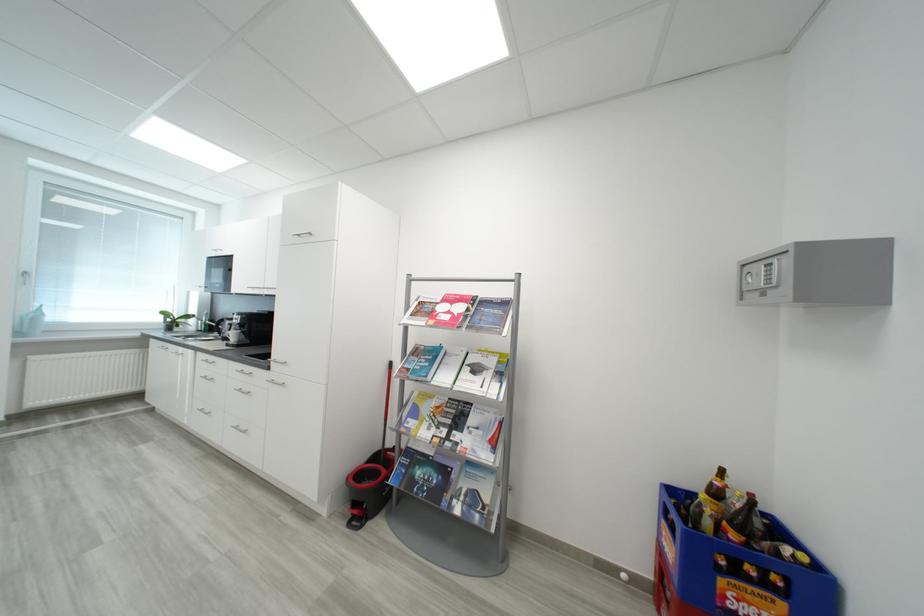
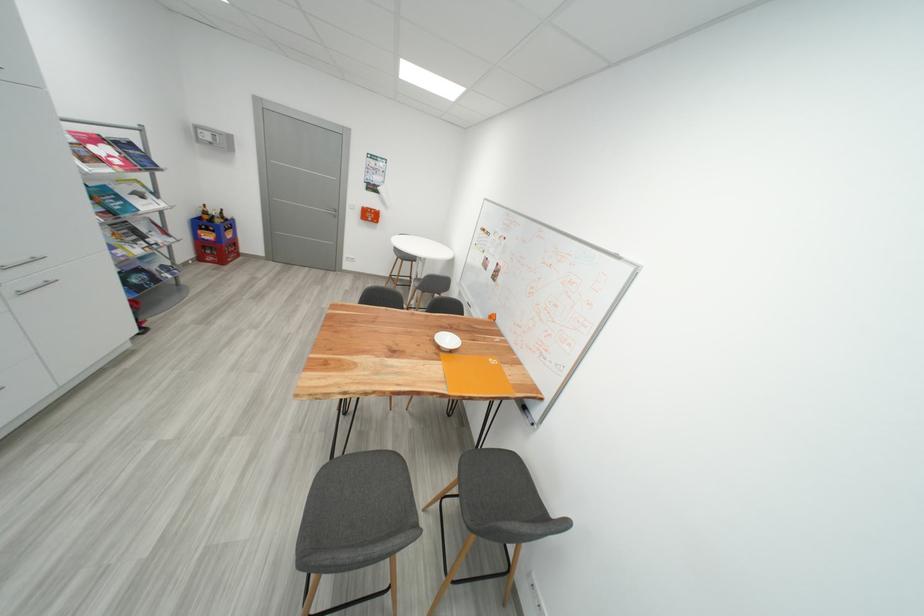
In the second image, find the point that corresponds to pixel 714 524 in the first image.

(225, 223)